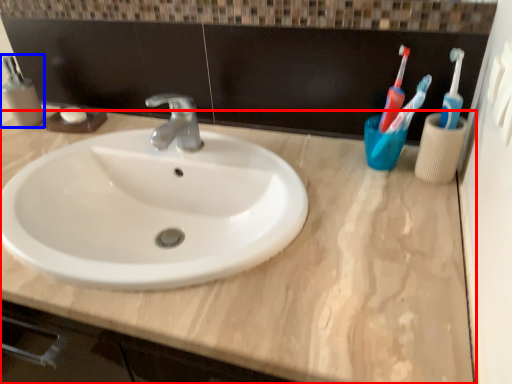
Question: Which object appears farthest to the camera in this image, counter top (highlighted by a red box) or mouthwash (highlighted by a blue box)?

Choices:
 (A) counter top
 (B) mouthwash

Answer: (B)